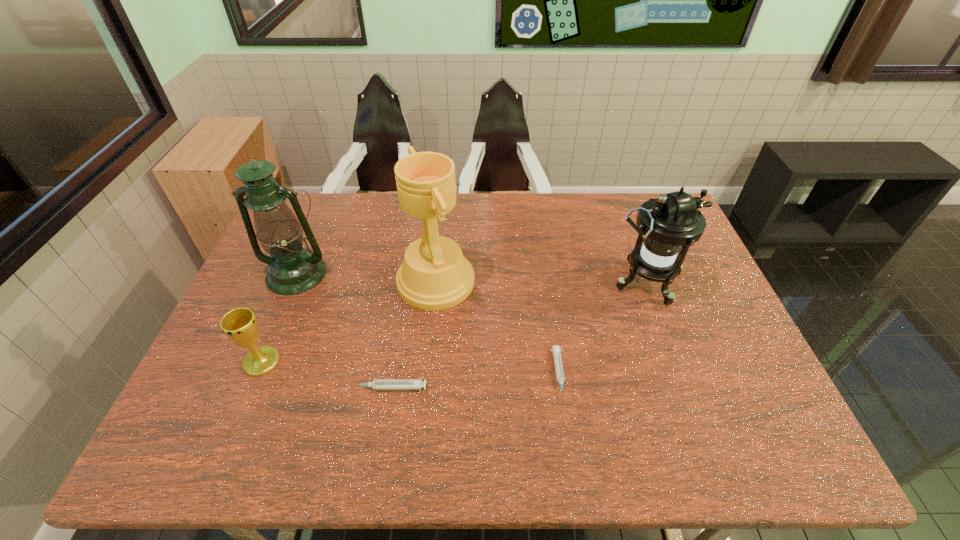
The width and height of the screenshot is (960, 540). Identify the location of vacant region at the near edge of the desktop. (495, 383).

Find the location of a particular element. The height and width of the screenshot is (540, 960). vacant space at the far left corner is located at coordinates (313, 231).

This screenshot has height=540, width=960. Find the location of `free space between the second shortest object and the chalice`. free space between the second shortest object and the chalice is located at coordinates (324, 375).

Locate an element on the screen. vacant area that lies between the oil lamp and the chalice is located at coordinates (x=279, y=318).

The height and width of the screenshot is (540, 960). What are the coordinates of `vacant point located between the shorter syringe and the left syringe` in the screenshot? It's located at (473, 381).

At what (x,y) coordinates should I click in order to perform the action: click on free spot between the taller syringe and the oil lamp. Please return your answer as a coordinate pair (x, y). Image resolution: width=960 pixels, height=540 pixels. Looking at the image, I should click on (342, 331).

What are the coordinates of `vacant area that lies between the fourth tallest object and the fourth shortest object` in the screenshot? It's located at (454, 322).

Where is `free point between the fourth tallest object and the rightmost object`? This screenshot has height=540, width=960. free point between the fourth tallest object and the rightmost object is located at coordinates (454, 322).

In order to click on unoccupied position between the award and the left syringe in this screenshot , I will do `click(412, 335)`.

Locate an element on the screen. The width and height of the screenshot is (960, 540). free space between the second object from right to left and the award is located at coordinates (497, 328).